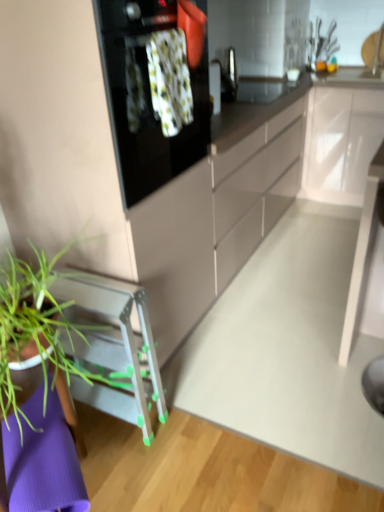
Question: Is point (365, 177) positioned closer to the camera than point (135, 416)?

Choices:
 (A) farther
 (B) closer

Answer: (A)

Question: Is white glossy cabinet at upper right spatially inside green plastic stool at lower left, or outside of it?

Choices:
 (A) inside
 (B) outside

Answer: (B)

Question: Based on their relative distances, which object is farther from the white glossy cabinet at upper right?

Choices:
 (A) green plastic stool at lower left
 (B) black glass oven at upper center
 (C) white glossy table at center

Answer: (A)

Question: Which object is the farthest from the black glass oven at upper center?

Choices:
 (A) white glossy cabinet at upper right
 (B) white glossy table at center
 (C) green plastic stool at lower left

Answer: (A)